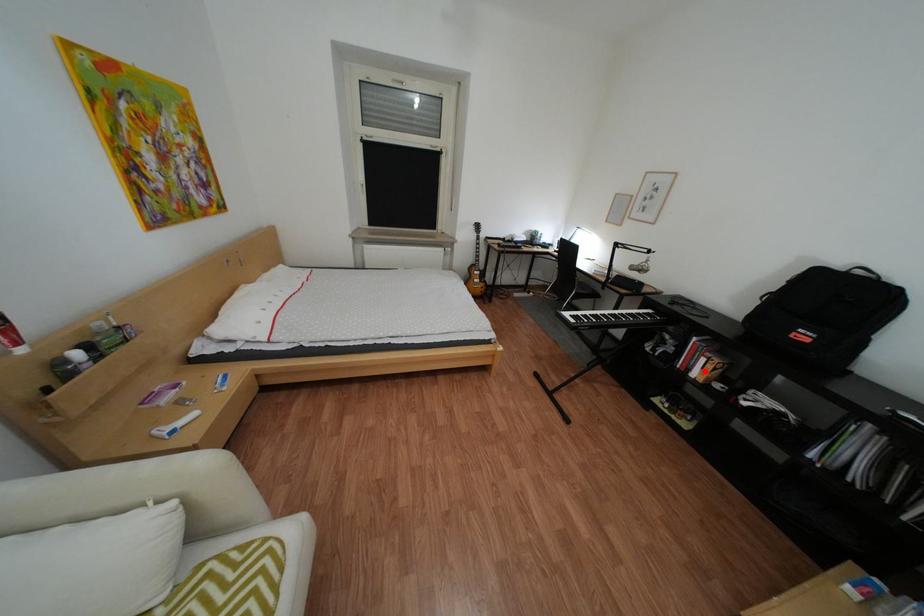
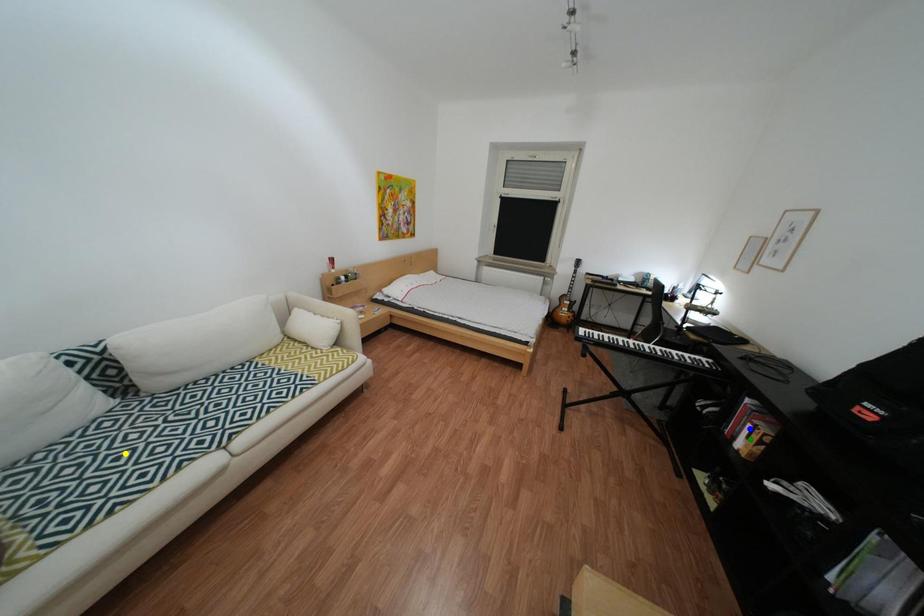
Question: I am providing you with two images of the same scene from different viewpoints. A red point is marked on the first image. You are given multiple points on the second image. Can you choose the point in image 2 that corresponds to the point in image 1?

Choices:
 (A) green point
 (B) blue point
 (C) yellow point

Answer: (A)